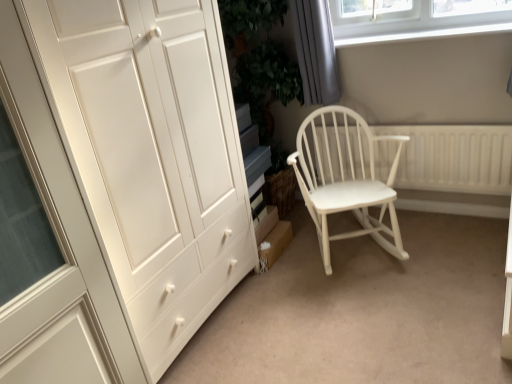
Find the location of a particular element. free spot below gray fabric curtain at upper right (from a real-world perspective) is located at coordinates (326, 102).